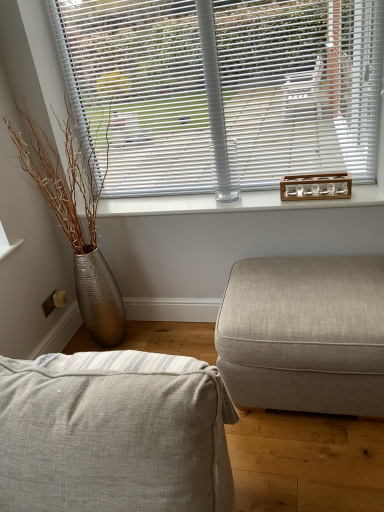
Question: Does textured beige ottoman at right, which ranks as the first studio couch in back-to-front order, have a greater width compared to clear glass bottle at center?

Choices:
 (A) no
 (B) yes

Answer: (B)

Question: Is textured beige ottoman at right, acting as the 2th studio couch starting from the left, not near clear glass bottle at center?

Choices:
 (A) yes
 (B) no

Answer: (B)

Question: Considering the relative positions of textured beige ottoman at right, marked as the first studio couch in a right-to-left arrangement, and clear glass bottle at center in the image provided, is textured beige ottoman at right, marked as the first studio couch in a right-to-left arrangement, to the right of clear glass bottle at center from the viewer's perspective?

Choices:
 (A) yes
 (B) no

Answer: (A)

Question: Can we say textured beige ottoman at right, arranged as the second studio couch when viewed from the front, lies outside clear glass bottle at center?

Choices:
 (A) yes
 (B) no

Answer: (A)

Question: Is textured beige ottoman at right, which ranks as the first studio couch in back-to-front order, positioned before clear glass bottle at center?

Choices:
 (A) no
 (B) yes

Answer: (B)

Question: From a real-world perspective, is textured beige ottoman at right, which ranks as the first studio couch in back-to-front order, physically located above or below white plastic blinds at upper center?

Choices:
 (A) below
 (B) above

Answer: (A)

Question: From their relative heights in the image, would you say textured beige ottoman at right, acting as the 2th studio couch starting from the left, is taller or shorter than white plastic blinds at upper center?

Choices:
 (A) short
 (B) tall

Answer: (A)

Question: Choose the correct answer: Is textured beige ottoman at right, arranged as the second studio couch when viewed from the front, inside white plastic blinds at upper center or outside it?

Choices:
 (A) inside
 (B) outside

Answer: (B)

Question: Considering the positions of textured beige ottoman at right, marked as the first studio couch in a right-to-left arrangement, and white plastic blinds at upper center in the image, is textured beige ottoman at right, marked as the first studio couch in a right-to-left arrangement, wider or thinner than white plastic blinds at upper center?

Choices:
 (A) wide
 (B) thin

Answer: (A)

Question: Is textured beige fabric couch at lower center, which is the 1th studio couch in front-to-back order, situated inside white plastic blinds at upper center or outside?

Choices:
 (A) inside
 (B) outside

Answer: (B)

Question: Is textured beige fabric couch at lower center, which appears as the first studio couch when viewed from the left, taller or shorter than white plastic blinds at upper center?

Choices:
 (A) tall
 (B) short

Answer: (B)

Question: From a real-world perspective, relative to white plastic blinds at upper center, is textured beige fabric couch at lower center, which is counted as the second studio couch, starting from the back, vertically above or below?

Choices:
 (A) above
 (B) below

Answer: (B)

Question: Is textured beige fabric couch at lower center, which is counted as the second studio couch, starting from the back, bigger or smaller than white plastic blinds at upper center?

Choices:
 (A) small
 (B) big

Answer: (B)

Question: In terms of height, does white plastic blinds at upper center look taller or shorter compared to clear glass bottle at center?

Choices:
 (A) short
 (B) tall

Answer: (B)

Question: From the image's perspective, is white plastic blinds at upper center located above or below clear glass bottle at center?

Choices:
 (A) below
 (B) above

Answer: (B)